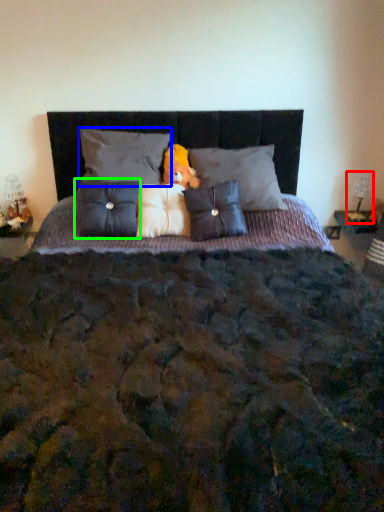
Question: Estimate the real-world distances between objects in this image. Which object is closer to table lamp (highlighted by a red box), pillow (highlighted by a blue box) or pillow (highlighted by a green box)?

Choices:
 (A) pillow
 (B) pillow

Answer: (A)